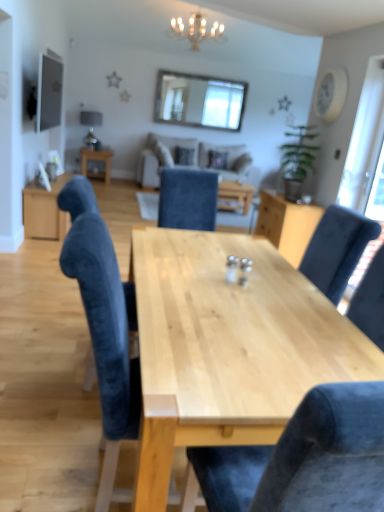
What is the approximate height of velvet blue chair at center, acting as the 2th chair starting from the front?

velvet blue chair at center, acting as the 2th chair starting from the front, is 1.10 meters tall.

You are a GUI agent. You are given a task and a screenshot of the screen. Output one action in this format:
    pyautogui.click(x=<x>, y=<y>)
    Task: Click on the light wood cabinet at center
    
    Given the screenshot: What is the action you would take?
    pyautogui.click(x=287, y=224)

In order to face light wood cabinet at center, should I rotate leftwards or rightwards?

You should rotate right by 12.147 degrees.

Describe the element at coordinates (199, 101) in the screenshot. I see `clear glass window at upper center, marked as the 2th window screen in a right-to-left arrangement` at that location.

Identify the location of crystal chandelier at upper center. The width and height of the screenshot is (384, 512). (196, 30).

You are a GUI agent. You are given a task and a screenshot of the screen. Output one action in this format:
    pyautogui.click(x=<x>, y=<y>)
    Task: Click on the velvet blue chair at center, acting as the 2th chair starting from the front
    The width and height of the screenshot is (384, 512).
    Given the screenshot: What is the action you would take?
    pyautogui.click(x=77, y=197)

Looking at this image, is velvet blue chair at center, acting as the 2th chair starting from the front, inside or outside of clear glass window at upper center, the first window screen when ordered from back to front?

velvet blue chair at center, acting as the 2th chair starting from the front, exists outside the volume of clear glass window at upper center, the first window screen when ordered from back to front.

From a real-world perspective, which is physically below, velvet blue chair at center, arranged as the 1th chair when viewed from the back, or clear glass window at upper center, marked as the 2th window screen in a right-to-left arrangement?

velvet blue chair at center, arranged as the 1th chair when viewed from the back.

From the image's perspective, relative to clear glass window at upper center, marked as the 2th window screen in a right-to-left arrangement, is velvet blue chair at center, arranged as the 1th chair when viewed from the back, above or below?

Clearly, from the image's perspective, velvet blue chair at center, arranged as the 1th chair when viewed from the back, is below clear glass window at upper center, marked as the 2th window screen in a right-to-left arrangement.

Which is less distant, (91,156) or (238,127)?

Point (91,156).

From the image's perspective, is wooden table at center, which appears as the 1th table when viewed from the left, beneath clear glass window at upper center, the second window screen from the front?

Yes.

In the image, is wooden table at center, marked as the second table in a right-to-left arrangement, on the left side or the right side of clear glass window at upper center, marked as the 2th window screen in a right-to-left arrangement?

Based on their positions, wooden table at center, marked as the second table in a right-to-left arrangement, is located to the left of clear glass window at upper center, marked as the 2th window screen in a right-to-left arrangement.

Can you tell me how much wooden table at center, which is the second table in front-to-back order, and transparent glass door at right, which appears as the second window screen when viewed from the left, differ in facing direction?

180 degrees.

Is wooden table at center, which ranks as the 1th table in top-to-bottom order, in front of or behind transparent glass door at right, the 2th window screen from the back, in the image?

wooden table at center, which ranks as the 1th table in top-to-bottom order, is behind transparent glass door at right, the 2th window screen from the back.

From the image's perspective, between wooden table at center, which appears as the 1th table when viewed from the left, and transparent glass door at right, which appears as the 1th window screen when viewed from the front, which one is located above?

From the image's view, wooden table at center, which appears as the 1th table when viewed from the left, is above.

Which of these two, wooden table at center, which appears as the 1th table when viewed from the left, or transparent glass door at right, which appears as the 1th window screen when viewed from the front, is smaller?

With smaller size is transparent glass door at right, which appears as the 1th window screen when viewed from the front.

Locate an element on the screen. The height and width of the screenshot is (512, 384). table that is the 1st object to the left of the beige fabric couch at center, starting at the anchor is located at coordinates (228, 347).

Is beige fabric couch at center not near natural wood table at center, which is the first table from right to left?

Yes, beige fabric couch at center and natural wood table at center, which is the first table from right to left, are quite far apart.

From a real-world perspective, is beige fabric couch at center positioned under natural wood table at center, which is the second table in top-to-bottom order, based on gravity?

No.

Is point (359, 105) closer to camera compared to point (266, 201)?

Yes, point (359, 105) is in front of point (266, 201).

Is transparent glass door at right, placed as the first window screen when sorted from bottom to top, to the left or to the right of light wood cabinet at center in the image?

From the image, it's evident that transparent glass door at right, placed as the first window screen when sorted from bottom to top, is to the right of light wood cabinet at center.

From the image's perspective, relative to light wood cabinet at center, is transparent glass door at right, which appears as the 1th window screen when viewed from the front, above or below?

transparent glass door at right, which appears as the 1th window screen when viewed from the front, is situated higher than light wood cabinet at center in the image.

Is there a large distance between transparent glass door at right, the 2th window screen from the back, and light wood cabinet at center?

No, transparent glass door at right, the 2th window screen from the back, is in close proximity to light wood cabinet at center.

Between point (178, 24) and point (92, 286), which one is positioned behind?

The point (178, 24) is behind.

Where is `light fixture positioned vertically above the velvet blue chair at center, the second chair when ordered from back to front (from a real-world perspective)`? The image size is (384, 512). light fixture positioned vertically above the velvet blue chair at center, the second chair when ordered from back to front (from a real-world perspective) is located at coordinates (196, 30).

Considering the sizes of crystal chandelier at upper center and velvet blue chair at center, which is the first chair in front-to-back order, in the image, is crystal chandelier at upper center taller or shorter than velvet blue chair at center, which is the first chair in front-to-back order,?

In the image, crystal chandelier at upper center appears to be shorter than velvet blue chair at center, which is the first chair in front-to-back order.

Is the depth of crystal chandelier at upper center less than that of velvet blue chair at center, which is the first chair in front-to-back order?

No, it is not.

Considering the positions of objects velvet blue chair at center, which is the first chair in front-to-back order, and light wood cabinet at center in the image provided, who is more to the left, velvet blue chair at center, which is the first chair in front-to-back order, or light wood cabinet at center?

velvet blue chair at center, which is the first chair in front-to-back order.

Is velvet blue chair at center, the second chair when ordered from back to front, directly adjacent to light wood cabinet at center?

No, velvet blue chair at center, the second chair when ordered from back to front, is not beside light wood cabinet at center.

Considering their positions, is velvet blue chair at center, which is the first chair in front-to-back order, located in front of or behind light wood cabinet at center?

Visually, velvet blue chair at center, which is the first chair in front-to-back order, is located in front of light wood cabinet at center.

Does velvet blue chair at center, the second chair when ordered from back to front, turn towards light wood cabinet at center?

No, velvet blue chair at center, the second chair when ordered from back to front, is not turned towards light wood cabinet at center.

What are the coordinates of `window screen that is the 2nd one when counting upward from the velvet blue chair at center, acting as the 2th chair starting from the front (from the image's perspective)` in the screenshot? It's located at (199, 101).

You are a GUI agent. You are given a task and a screenshot of the screen. Output one action in this format:
    pyautogui.click(x=<x>, y=<y>)
    Task: Click on the window screen that is the 1st object to the right of the wooden table at center, placed as the 1th table when sorted from back to front, starting at the anchor
    This screenshot has height=512, width=384.
    Given the screenshot: What is the action you would take?
    [199, 101]

Based on their spatial positions, is light wood cabinet at center or velvet blue chair at center, the second chair when ordered from back to front, further from clear glass window at upper center, acting as the 1th window screen starting from the top?

velvet blue chair at center, the second chair when ordered from back to front, lies further to clear glass window at upper center, acting as the 1th window screen starting from the top, than the other object.

Considering their positions, is beige fabric couch at center positioned closer to velvet blue chair at center, which is the first chair in front-to-back order, than clear glass window at upper center, marked as the 2th window screen in a right-to-left arrangement?

beige fabric couch at center is positioned closer to the anchor velvet blue chair at center, which is the first chair in front-to-back order.

Considering their positions, is velvet blue chair at center, which is the first chair in front-to-back order, positioned closer to beige fabric couch at center than velvet blue chair at center, arranged as the 1th chair when viewed from the back?

velvet blue chair at center, arranged as the 1th chair when viewed from the back.

When comparing their distances from wooden table at center, which is the second table in front-to-back order, does beige fabric couch at center or transparent glass door at right, which is the first window screen from right to left, seem closer?

beige fabric couch at center.

Based on their spatial positions, is velvet blue chair at center, which is the first chair in front-to-back order, or velvet blue chair at center, acting as the 2th chair starting from the front, closer to crystal chandelier at upper center?

velvet blue chair at center, acting as the 2th chair starting from the front.

When comparing their distances from light wood cabinet at center, does crystal chandelier at upper center or transparent glass door at right, which appears as the 1th window screen when viewed from the front, seem further?

crystal chandelier at upper center lies further to light wood cabinet at center than the other object.

From the image, which object appears to be farther from velvet blue chair at center, acting as the 2th chair starting from the front, light wood cabinet at center or wooden table at center, which ranks as the 1th table in top-to-bottom order?

Among the two, wooden table at center, which ranks as the 1th table in top-to-bottom order, is located further to velvet blue chair at center, acting as the 2th chair starting from the front.

Consider the image. Considering their positions, is velvet blue chair at center, which is the first chair in front-to-back order, positioned closer to wooden table at center, which appears as the 1th table when viewed from the left, than velvet blue chair at center, acting as the 2th chair starting from the front?

velvet blue chair at center, acting as the 2th chair starting from the front, is closer to wooden table at center, which appears as the 1th table when viewed from the left.

Locate an element on the screen. light fixture between transparent glass door at right, which appears as the second window screen when viewed from the left, and wooden table at center, which is the second table in front-to-back order, from front to back is located at coordinates (196, 30).

Locate an element on the screen. This screenshot has width=384, height=512. light fixture located between light wood cabinet at center and clear glass window at upper center, acting as the 1th window screen starting from the top, in the depth direction is located at coordinates (196, 30).

The image size is (384, 512). I want to click on cabinetry between velvet blue chair at center, which is the first chair in front-to-back order, and crystal chandelier at upper center from front to back, so click(287, 224).

Find the location of a particular element. The image size is (384, 512). window screen positioned between velvet blue chair at center, the second chair when ordered from back to front, and light wood cabinet at center from near to far is located at coordinates (366, 149).